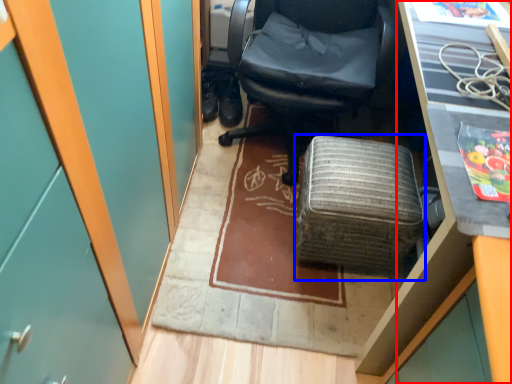
Question: Which point is closer to the camera, desk (highlighted by a red box) or furniture (highlighted by a blue box)?

Choices:
 (A) desk
 (B) furniture

Answer: (A)